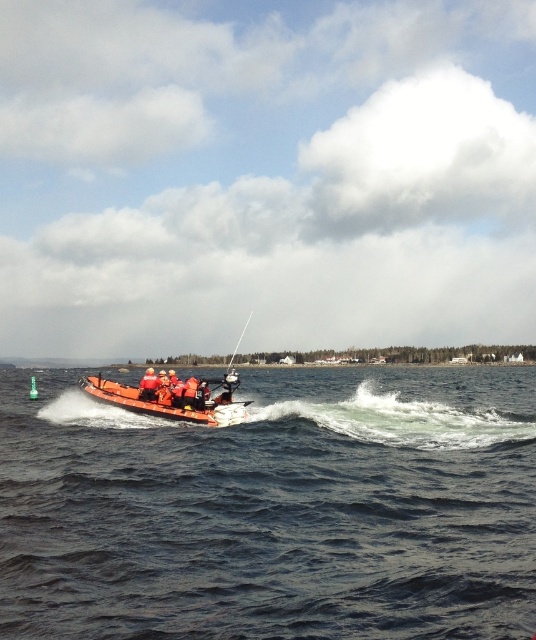
Question: Can you confirm if orange rubber boat at center is positioned below orange life jacket at center?

Choices:
 (A) yes
 (B) no

Answer: (A)

Question: Which object is farther from the camera taking this photo?

Choices:
 (A) dark blue water at center
 (B) orange life jacket at center
 (C) orange rubber boat at center

Answer: (B)

Question: Can you confirm if orange rubber boat at center is thinner than orange life jacket at center?

Choices:
 (A) no
 (B) yes

Answer: (A)

Question: Does orange rubber boat at center appear over orange life jacket at center?

Choices:
 (A) yes
 (B) no

Answer: (B)

Question: Which point is farther from the camera taking this photo?

Choices:
 (A) (139, 381)
 (B) (219, 380)
 (C) (273, 387)

Answer: (C)

Question: Which object is farther from the camera taking this photo?

Choices:
 (A) dark blue water at center
 (B) orange life jacket at center

Answer: (B)